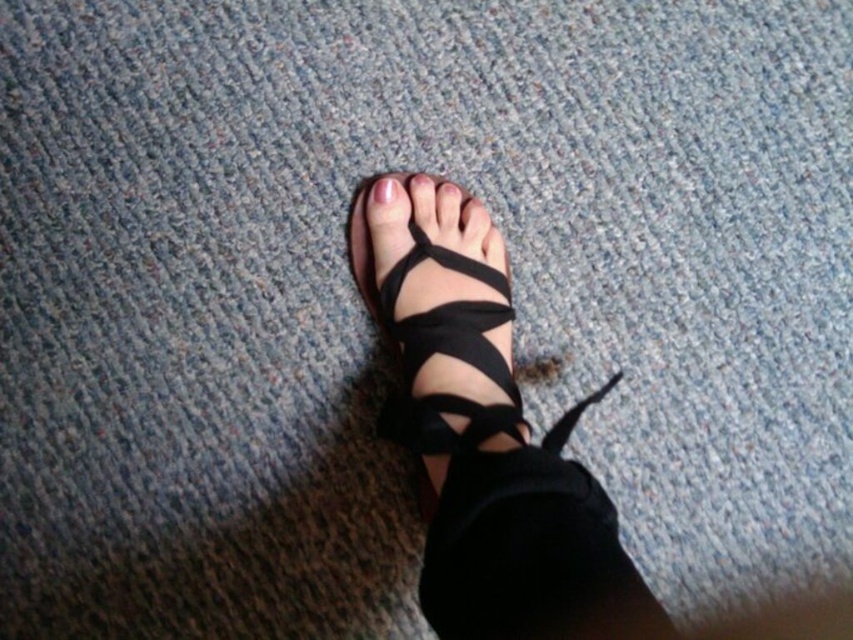
Question: Can you confirm if black leather sandals at center is thinner than pink matte nail at center?

Choices:
 (A) yes
 (B) no

Answer: (B)

Question: Does black leather sandal at center appear on the right side of matte black toe at center?

Choices:
 (A) no
 (B) yes

Answer: (A)

Question: Which of these objects is positioned closest to the pink matte nail at center?

Choices:
 (A) black leather sandal at center
 (B) black leather sandals at center

Answer: (A)

Question: Is black leather strap at lower center above matte black toe at center?

Choices:
 (A) yes
 (B) no

Answer: (B)

Question: Which object is closer to the camera taking this photo?

Choices:
 (A) black leather sandal at center
 (B) pink matte nail at center

Answer: (A)

Question: Estimate the real-world distances between objects in this image. Which object is farther from the black leather sandals at center?

Choices:
 (A) pink matte nail at center
 (B) matte black toe at center
 (C) black leather strap at lower center
 (D) black leather sandal at center

Answer: (A)